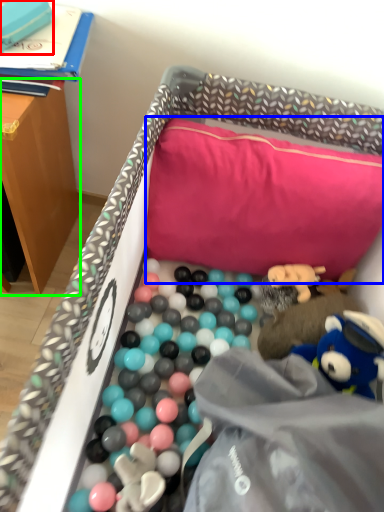
Question: Based on their relative distances, which object is nearer to toy (highlighted by a red box)? Choose from pillow (highlighted by a blue box) and table (highlighted by a green box).

Choices:
 (A) pillow
 (B) table

Answer: (B)